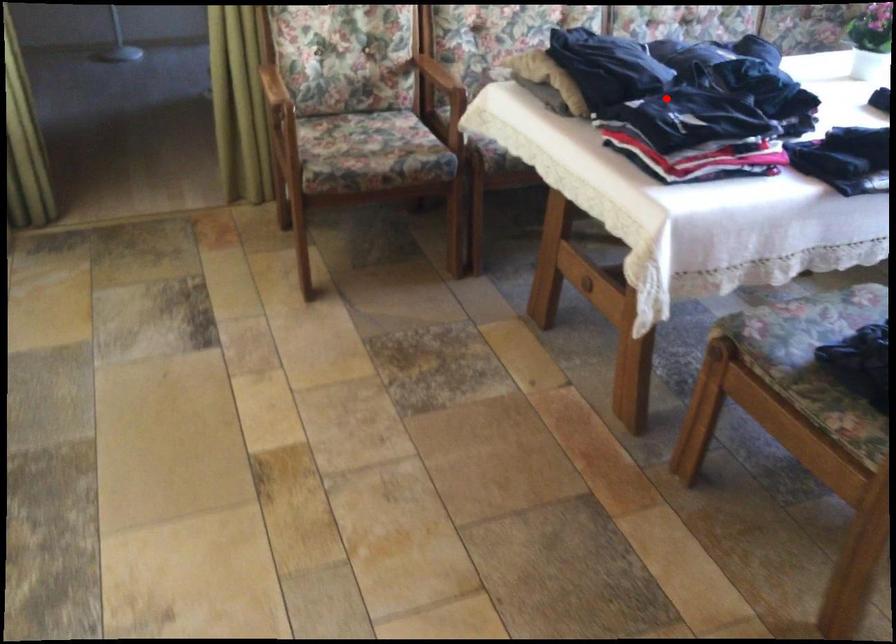
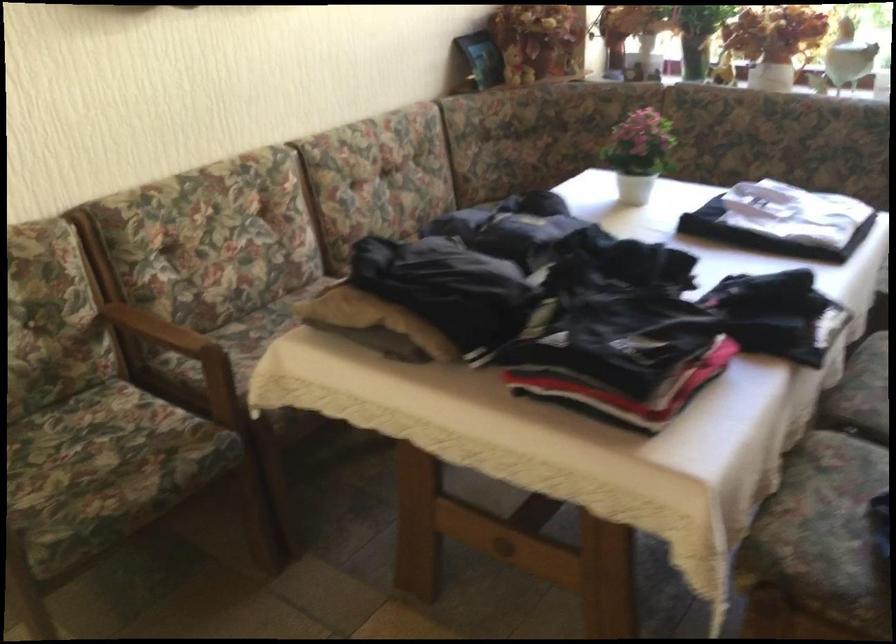
In the second image, find the point that corresponds to the highlighted location in the first image.

(589, 317)